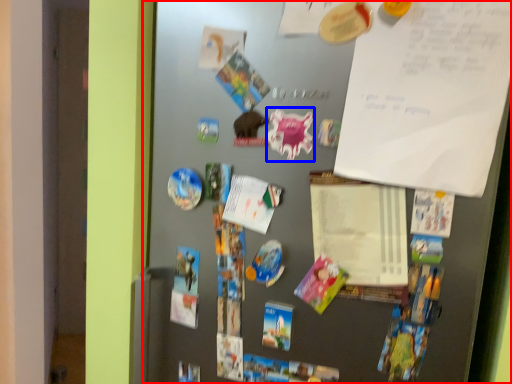
Question: Which object appears closest to the camera in this image, fridge (highlighted by a red box) or art (highlighted by a blue box)?

Choices:
 (A) fridge
 (B) art

Answer: (A)